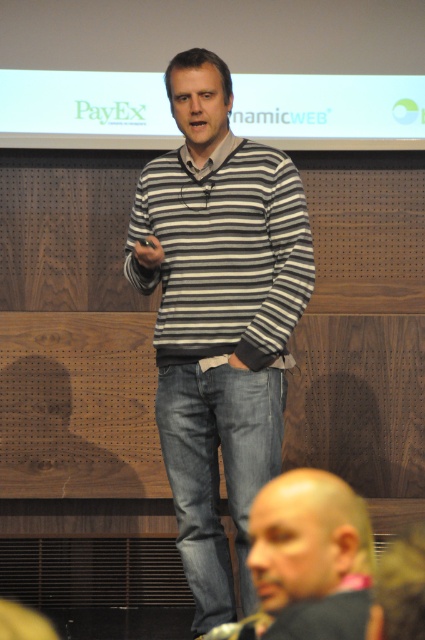
Is striped sweater at center wider than bald head at lower right?

Yes, striped sweater at center is wider than bald head at lower right.

Find the location of `striped sweater at center`. striped sweater at center is located at coordinates (218, 317).

You are a GUI agent. You are given a task and a screenshot of the screen. Output one action in this format:
    pyautogui.click(x=<x>, y=<y>)
    Task: Click on the striped sweater at center
    This screenshot has width=425, height=640.
    Given the screenshot: What is the action you would take?
    pyautogui.click(x=218, y=317)

Can you confirm if striped cotton sweater at center is positioned to the right of bald head at lower right?

No, striped cotton sweater at center is not to the right of bald head at lower right.

Between striped cotton sweater at center and bald head at lower right, which one appears on the right side from the viewer's perspective?

From the viewer's perspective, bald head at lower right appears more on the right side.

Is point (277, 189) behind point (342, 586)?

That is True.

Locate an element on the screen. This screenshot has height=640, width=425. striped cotton sweater at center is located at coordinates (223, 252).

Can you confirm if striped sweater at center is bigger than striped cotton sweater at center?

Indeed, striped sweater at center has a larger size compared to striped cotton sweater at center.

Between striped sweater at center and striped cotton sweater at center, which one has more height?

Standing taller between the two is striped sweater at center.

You are a GUI agent. You are given a task and a screenshot of the screen. Output one action in this format:
    pyautogui.click(x=<x>, y=<y>)
    Task: Click on the striped sweater at center
    This screenshot has height=640, width=425.
    Given the screenshot: What is the action you would take?
    coord(218,317)

Locate an element on the screen. striped sweater at center is located at coordinates (218, 317).